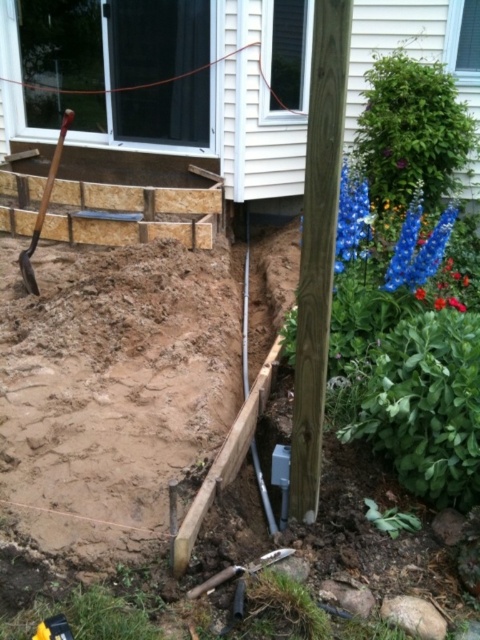
Which of these two, brown wood pole at center or wooden shovel at left, stands shorter?

Standing shorter between the two is wooden shovel at left.

Identify the location of brown wood pole at center. (317, 248).